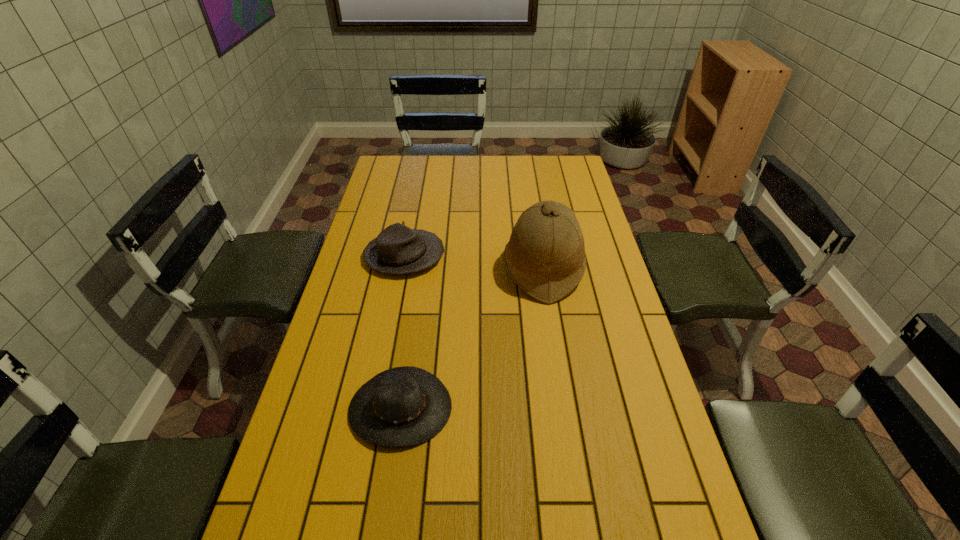
Image resolution: width=960 pixels, height=540 pixels. In order to click on the rightmost hat in this screenshot , I will do `click(545, 256)`.

Image resolution: width=960 pixels, height=540 pixels. I want to click on the rightmost object, so click(x=545, y=256).

I want to click on the nearest hat, so click(403, 406).

Find the location of a particular element. This screenshot has height=540, width=960. free space located on the front-facing side of the tallest object is located at coordinates (483, 268).

Find the location of a particular element. free space located on the front-facing side of the tallest object is located at coordinates (385, 268).

Locate an element on the screen. The width and height of the screenshot is (960, 540). vacant region located 0.100m on the front-facing side of the tallest object is located at coordinates (474, 268).

You are a GUI agent. You are given a task and a screenshot of the screen. Output one action in this format:
    pyautogui.click(x=<x>, y=<y>)
    Task: Click on the vacant space located on the front-facing side of the nearest object
    
    Given the screenshot: What is the action you would take?
    pyautogui.click(x=387, y=500)

This screenshot has width=960, height=540. In order to click on object that is at the right edge in this screenshot , I will do `click(545, 256)`.

This screenshot has width=960, height=540. In the image, there is a desktop. In order to click on vacant region at the far edge in this screenshot , I will do `click(457, 156)`.

Where is `vacant point at the left edge`? The image size is (960, 540). vacant point at the left edge is located at coordinates (402, 195).